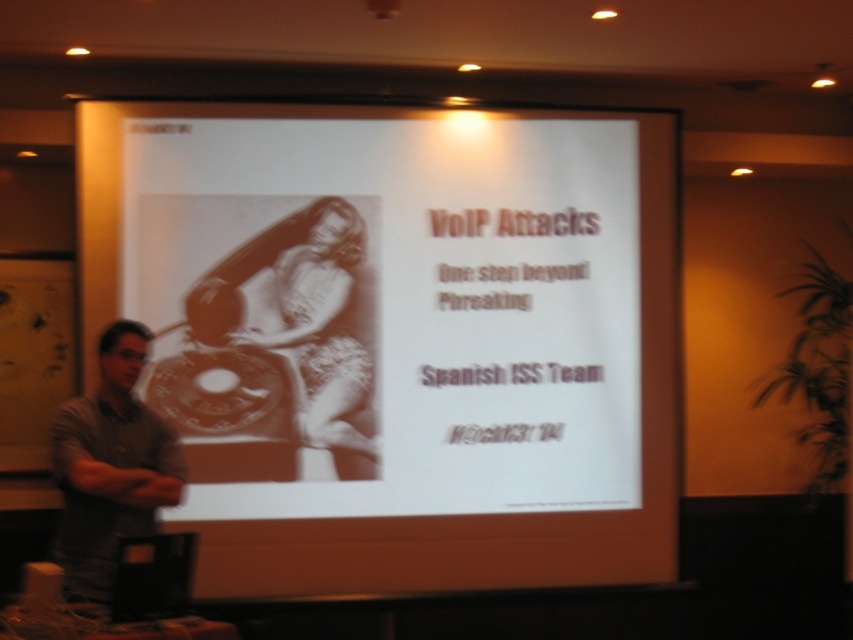
Does white paper at center have a larger size compared to gray casual shirt at left?

Indeed, white paper at center has a larger size compared to gray casual shirt at left.

Which is in front, point (482, 298) or point (131, 472)?

Point (131, 472) is more forward.

You are a GUI agent. You are given a task and a screenshot of the screen. Output one action in this format:
    pyautogui.click(x=<x>, y=<y>)
    Task: Click on the white paper at center
    
    Given the screenshot: What is the action you would take?
    pyautogui.click(x=398, y=337)